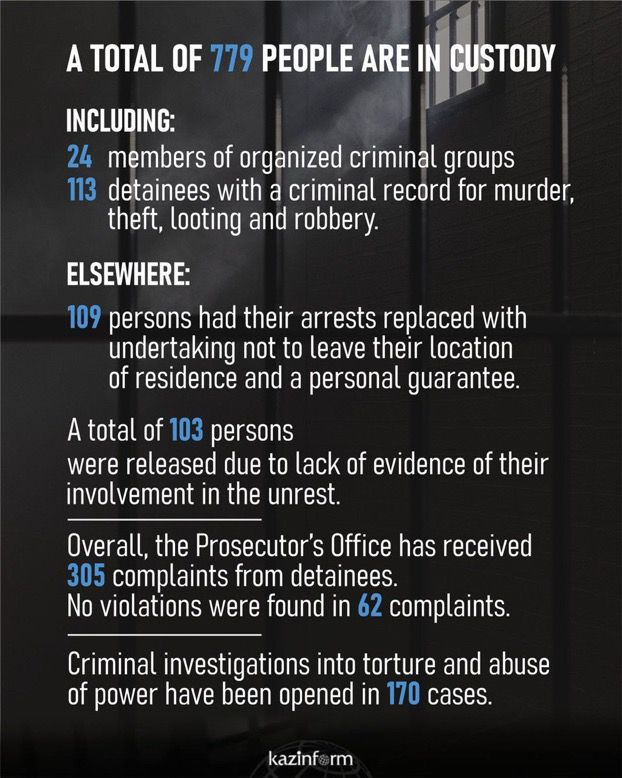
Image resolution: width=622 pixels, height=778 pixels. I want to click on globe, so click(x=341, y=765).